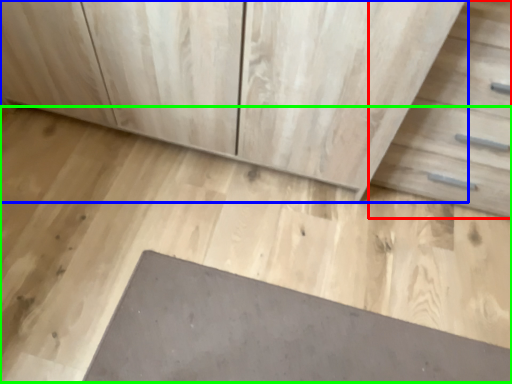
Question: Considering the real-world distances, which object is farthest from drawer (highlighted by a red box)? chest of drawers (highlighted by a blue box) or concrete (highlighted by a green box)?

Choices:
 (A) chest of drawers
 (B) concrete

Answer: (B)